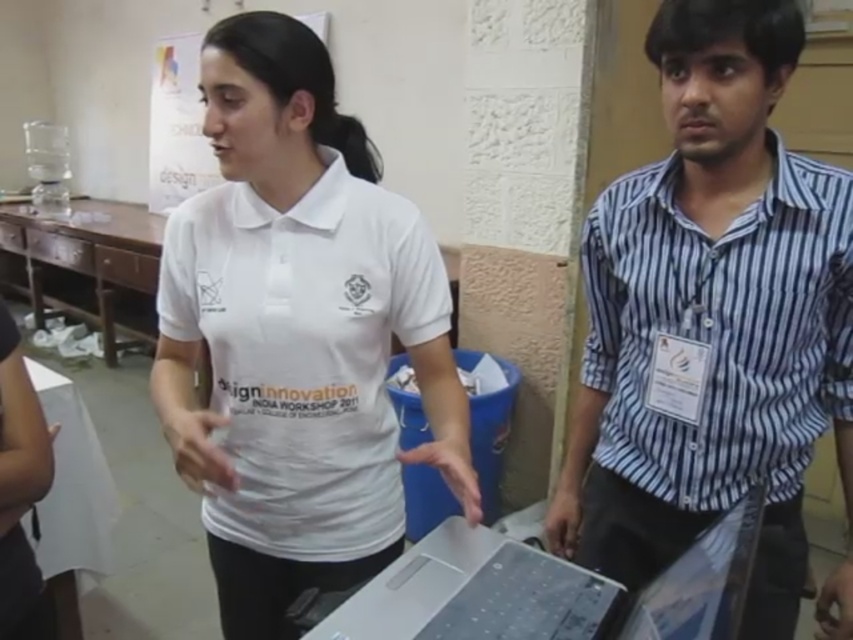
Is white matte shirt at center closer to camera compared to blue striped shirt at right?

No.

Is point (310, 467) more distant than point (642, 330)?

That is True.

Locate an element on the screen. This screenshot has width=853, height=640. white matte shirt at center is located at coordinates (297, 332).

Who is positioned more to the right, blue striped shirt at right or silver metallic laptop at center?

From the viewer's perspective, blue striped shirt at right appears more on the right side.

The height and width of the screenshot is (640, 853). What do you see at coordinates (712, 317) in the screenshot?
I see `blue striped shirt at right` at bounding box center [712, 317].

Between point (750, 355) and point (474, 540), which one is positioned in front?

Point (750, 355)

You are a GUI agent. You are given a task and a screenshot of the screen. Output one action in this format:
    pyautogui.click(x=<x>, y=<y>)
    Task: Click on the blue striped shirt at right
    The height and width of the screenshot is (640, 853).
    Given the screenshot: What is the action you would take?
    pyautogui.click(x=712, y=317)

Is white matte shirt at center positioned behind silver metallic laptop at center?

Yes, white matte shirt at center is behind silver metallic laptop at center.

Between point (341, 472) and point (677, 566), which one is positioned in front?

Point (677, 566) is in front.

Is point (281, 636) farther from viewer compared to point (438, 596)?

Yes, point (281, 636) is farther from viewer.

At what (x,y) coordinates should I click in order to perform the action: click on white matte shirt at center. Please return your answer as a coordinate pair (x, y). This screenshot has height=640, width=853. Looking at the image, I should click on (297, 332).